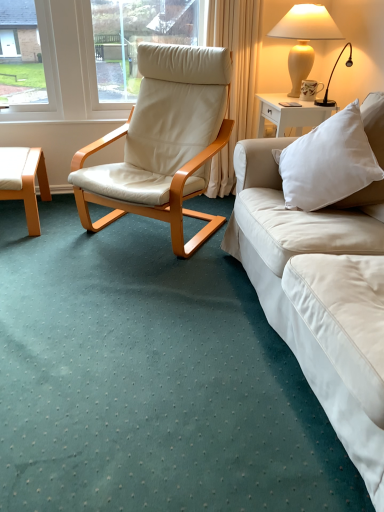
Question: Does matte ceramic mug at upper right have a lesser width compared to beige leather chair at center?

Choices:
 (A) yes
 (B) no

Answer: (A)

Question: From a real-world perspective, is matte ceramic mug at upper right over beige leather chair at center?

Choices:
 (A) yes
 (B) no

Answer: (A)

Question: Can you confirm if matte ceramic mug at upper right is positioned to the left of beige leather chair at center?

Choices:
 (A) yes
 (B) no

Answer: (B)

Question: Considering the relative sizes of matte ceramic mug at upper right and beige leather chair at center in the image provided, is matte ceramic mug at upper right bigger than beige leather chair at center?

Choices:
 (A) yes
 (B) no

Answer: (B)

Question: Does matte ceramic mug at upper right turn towards beige leather chair at center?

Choices:
 (A) no
 (B) yes

Answer: (B)

Question: Considering the relative sizes of matte ceramic mug at upper right and beige leather chair at center in the image provided, is matte ceramic mug at upper right smaller than beige leather chair at center?

Choices:
 (A) no
 (B) yes

Answer: (B)

Question: Is beige leather chair at center turned away from light brown wood coffee table at left?

Choices:
 (A) yes
 (B) no

Answer: (B)

Question: Does beige leather chair at center appear on the right side of light brown wood coffee table at left?

Choices:
 (A) yes
 (B) no

Answer: (A)

Question: Are beige leather chair at center and light brown wood coffee table at left far apart?

Choices:
 (A) yes
 (B) no

Answer: (B)

Question: Considering the relative positions of beige leather chair at center and light brown wood coffee table at left in the image provided, is beige leather chair at center to the left of light brown wood coffee table at left from the viewer's perspective?

Choices:
 (A) no
 (B) yes

Answer: (A)

Question: Is beige leather chair at center positioned beyond the bounds of light brown wood coffee table at left?

Choices:
 (A) no
 (B) yes

Answer: (B)

Question: Is beige leather chair at center next to light brown wood coffee table at left?

Choices:
 (A) yes
 (B) no

Answer: (B)

Question: Does light brown wood coffee table at left have a lesser width compared to matte cream vase at upper right?

Choices:
 (A) yes
 (B) no

Answer: (B)